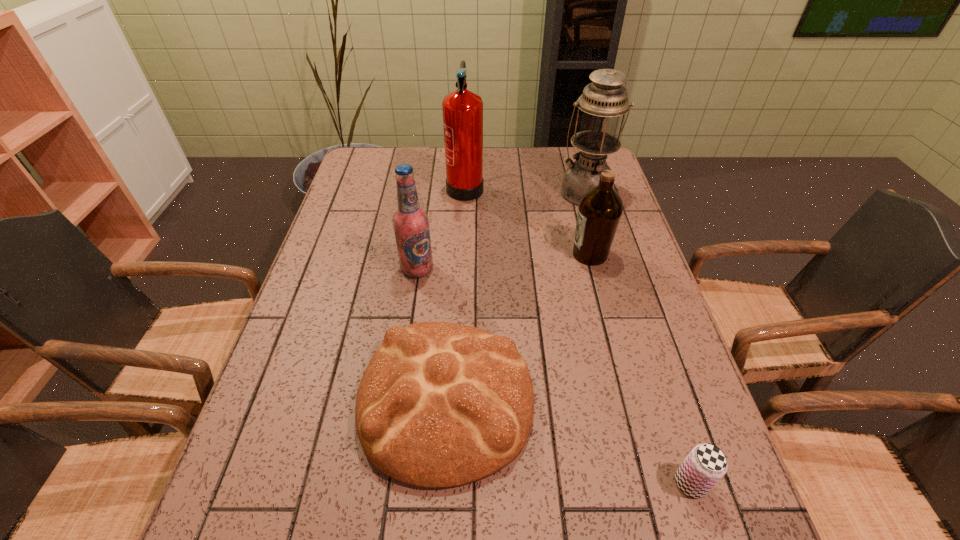
At what (x,y) coordinates should I click in order to perform the action: click on blank region between the fire extinguisher and the shortest object. Please return your answer as a coordinate pair (x, y). Looking at the image, I should click on (578, 334).

Where is `free space between the bread and the fire extinguisher`? This screenshot has height=540, width=960. free space between the bread and the fire extinguisher is located at coordinates (456, 292).

Choose which object is the second nearest neighbor to the olive oil. Please provide its 2D coordinates. Your answer should be formatted as a tuple, i.e. [(x, y)], where the tuple contains the x and y coordinates of a point satisfying the conditions above.

[(440, 404)]

What are the coordinates of `the third closest object relative to the fourth tallest object` in the screenshot? It's located at (462, 109).

Locate an element on the screen. The image size is (960, 540). vacant space that satisfies the following two spatial constraints: 1. on the label of the third shortest object; 2. on the front side of the fourth shortest object is located at coordinates (594, 269).

The image size is (960, 540). Find the location of `free space in the image that satisfies the following two spatial constraints: 1. on the front side of the shortest object; 2. on the right side of the alcohol`. free space in the image that satisfies the following two spatial constraints: 1. on the front side of the shortest object; 2. on the right side of the alcohol is located at coordinates (386, 483).

Identify the location of vacant area in the image that satisfies the following two spatial constraints: 1. on the back side of the fire extinguisher; 2. on the left side of the third tallest object. Image resolution: width=960 pixels, height=540 pixels. (429, 184).

The image size is (960, 540). I want to click on vacant space that satisfies the following two spatial constraints: 1. on the back side of the shortest object; 2. on the label of the third shortest object, so click(616, 254).

What are the coordinates of `free location that satisfies the following two spatial constraints: 1. on the back side of the fourth shortest object; 2. on the right side of the oil lamp` in the screenshot? It's located at (428, 192).